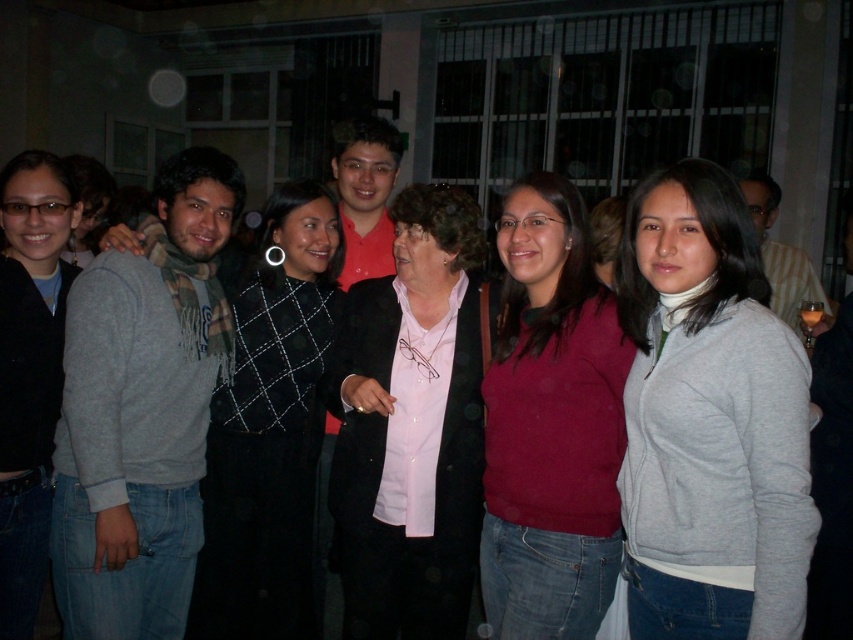
You are taking a photo of the group and need to adjust your camera focus. Which person is positioned to the right side of the other between the matte pink sweater at center and the matte red shirt at center?

The matte pink sweater at center is to the right of the matte red shirt at center.

You are standing in the room and want to hand a gift to the person wearing the pink matte shirt at center. However, there is a matte gray sweater at right in your path. Can you reach the person without moving the sweater?

The matte gray sweater at right is closer to the viewer than the pink matte shirt at center, so you can reach the person wearing the pink matte shirt at center without moving the sweater because the sweater is in front of them.